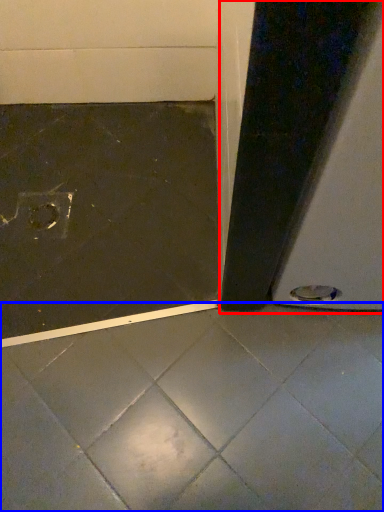
Question: Which point is closer to the camera, screen door (highlighted by a red box) or concrete (highlighted by a blue box)?

Choices:
 (A) screen door
 (B) concrete

Answer: (A)